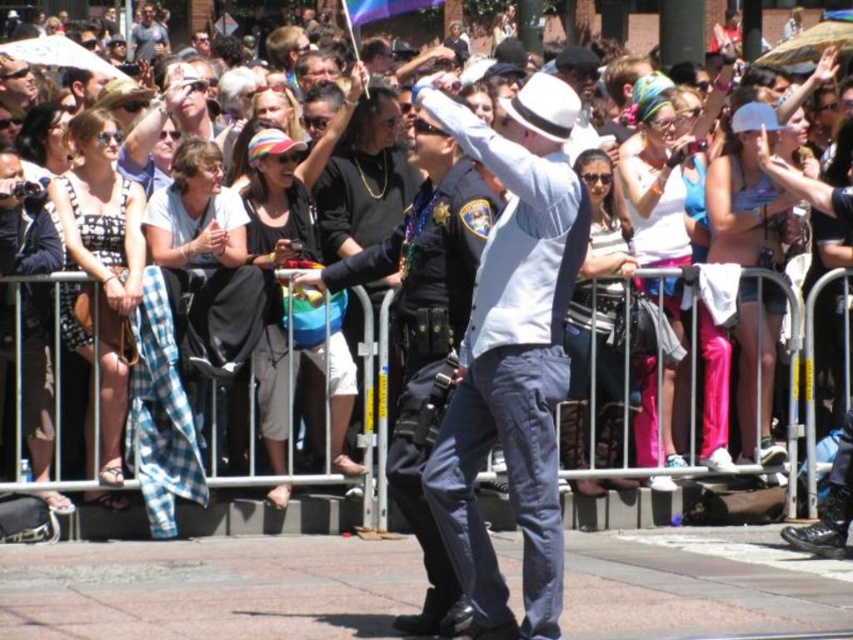
You are a photographer trying to capture both the matte black tank top at left and the matte black shirt at upper center in a single frame. Which of the two should you focus on first to ensure they are both in the shot?

The matte black tank top at left should be focused on first because it is positioned to the right of the matte black shirt at upper center, so adjusting the frame to include the rightmost subject ensures both are captured.

You are a photographer positioned at the back of the crowd behind the metal barricade. You want to take a clear photo of the white matte fedora at center from your current position. Considering the distance, can you capture it without zooming?

The white matte fedora at center is 34.36 meters away from the viewer. Depending on the camera lens and resolution, capturing clear details without zooming may be challenging, but the distance is feasible with a high quality camera.